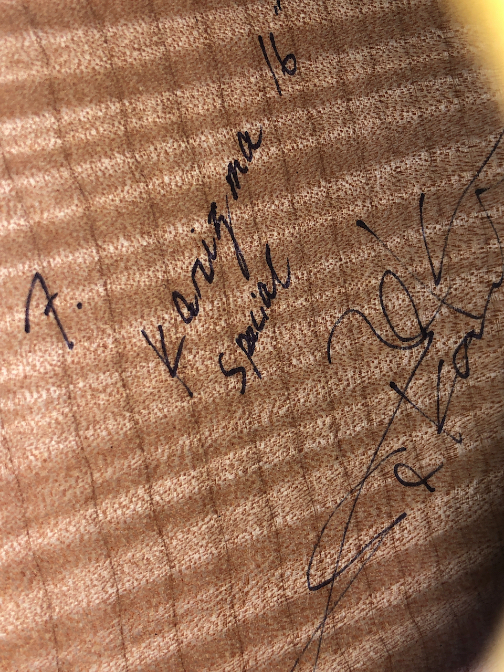
Find the location of a particular element. This screenshot has height=672, width=504. creme diagonal strip in fabric is located at coordinates [195, 541].